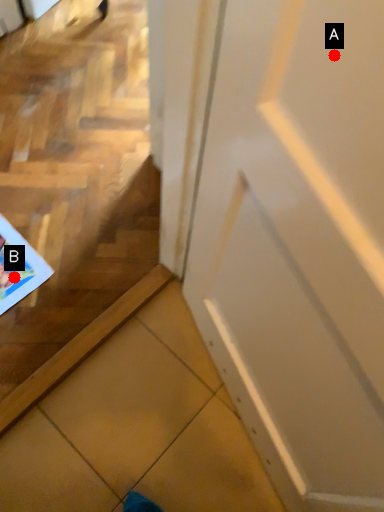
Question: Two points are circled on the image, labeled by A and B beside each circle. Which of the following is the closest to the observer?

Choices:
 (A) A is closer
 (B) B is closer

Answer: (A)